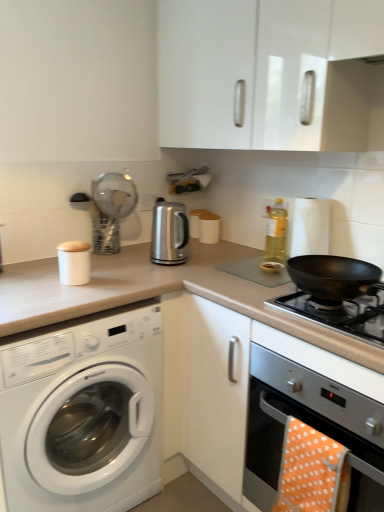
You are a GUI agent. You are given a task and a screenshot of the screen. Output one action in this format:
    pyautogui.click(x=<x>, y=<y>)
    Task: Click on the free space behind satin silver kettle at center, arranged as the third appliance when viewed from the left
    The image size is (384, 512).
    Given the screenshot: What is the action you would take?
    pyautogui.click(x=201, y=248)